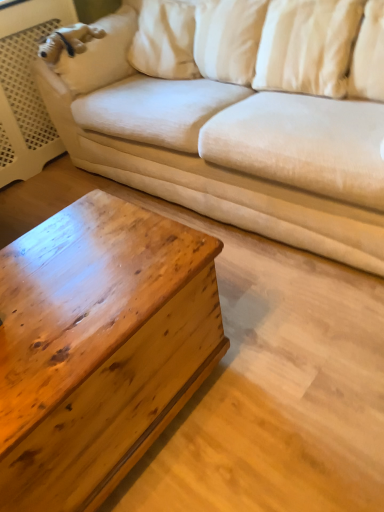
Identify the location of free spot to the right of wooden chestnut coffee table at lower left. Image resolution: width=384 pixels, height=512 pixels. (276, 372).